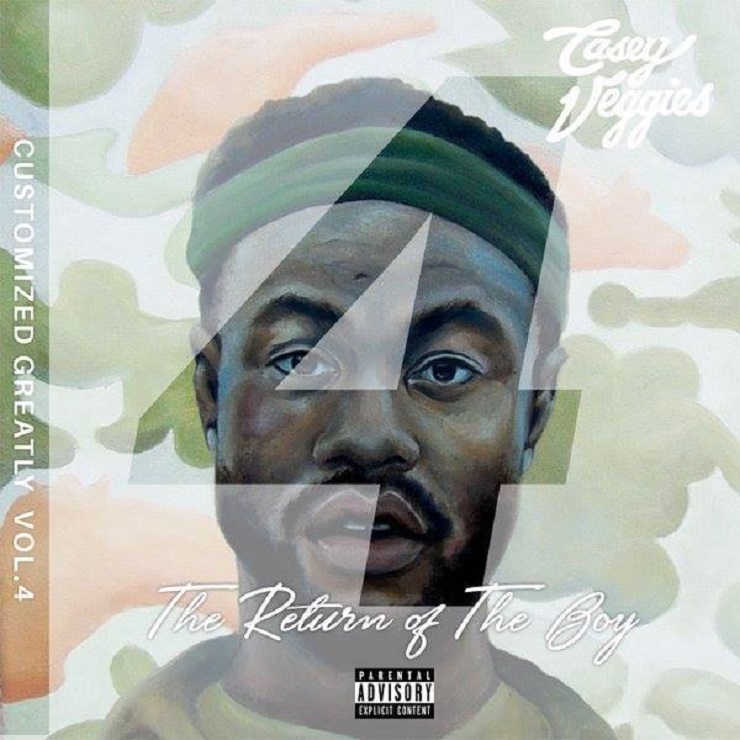
Where is `cover`? The image size is (740, 740). cover is located at coordinates (450, 363).